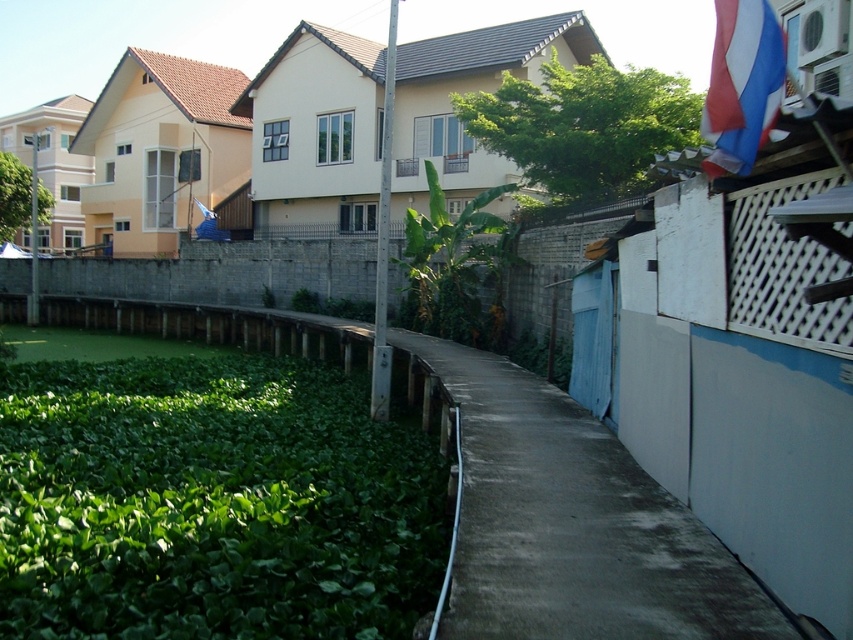
You are standing at the point marked by the coordinates point (212, 502). Looking around, you see green leafy algae at lower left. What is the nearest object to your current position?

The nearest object to your current position is the green leafy algae at lower left, as you are standing exactly at the point marked by the coordinates point (212, 502) which indicates its location.

You are standing at the starting point of the concrete pathway in the residential area. You need to place a small garden ornament exactly at the location of the green grass at lower left. What are the coordinates where you should place it?

The green grass at lower left is located at point (569, 520), so you should place the ornament at those coordinates.